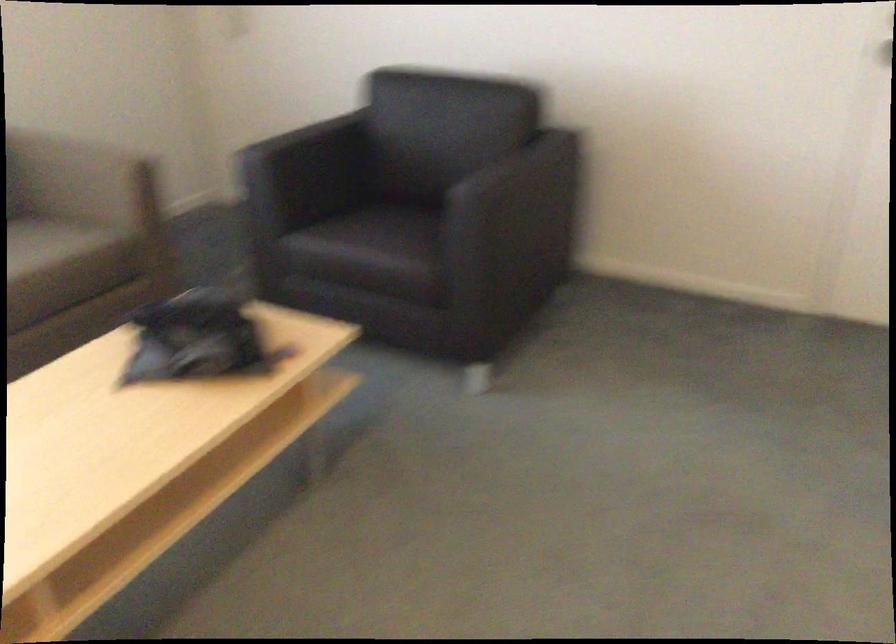
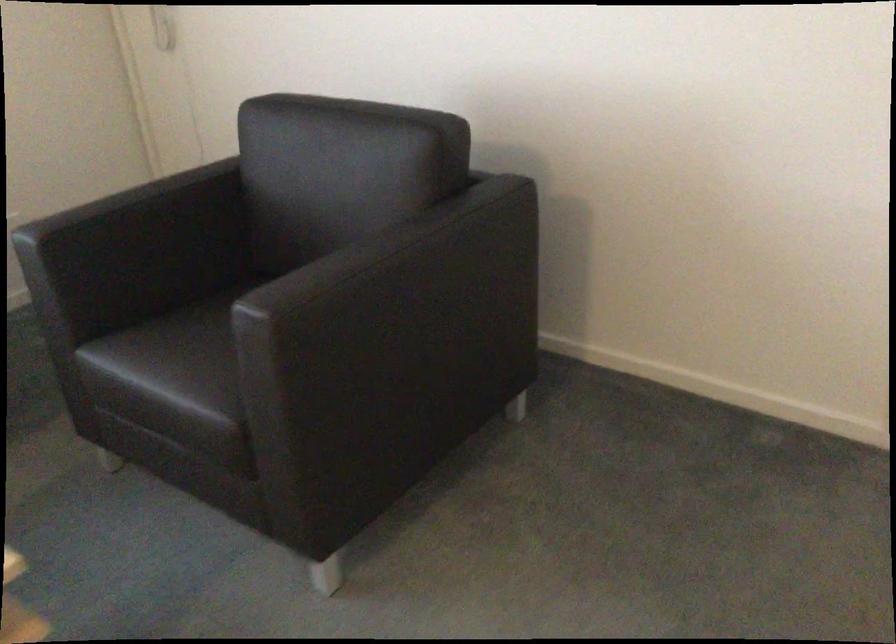
In the second image, find the point that corresponds to the point at 544,160 in the first image.

(419, 249)